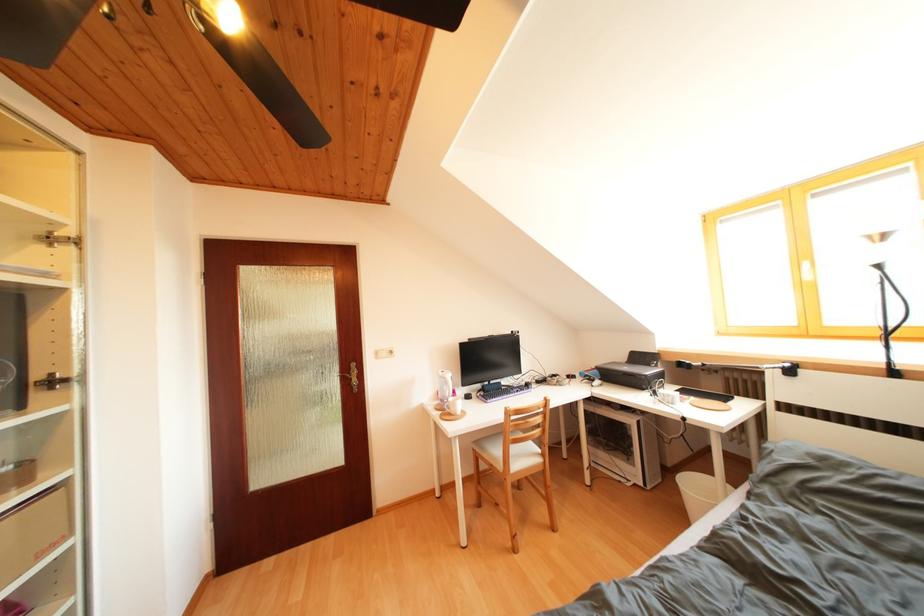
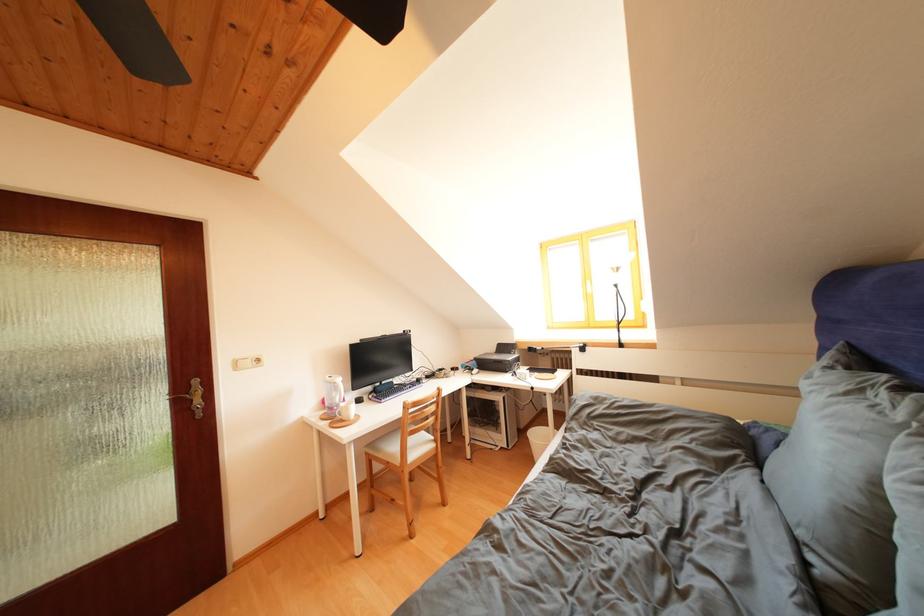
In the second image, find the point that corresponds to point (655, 370) in the first image.

(517, 358)